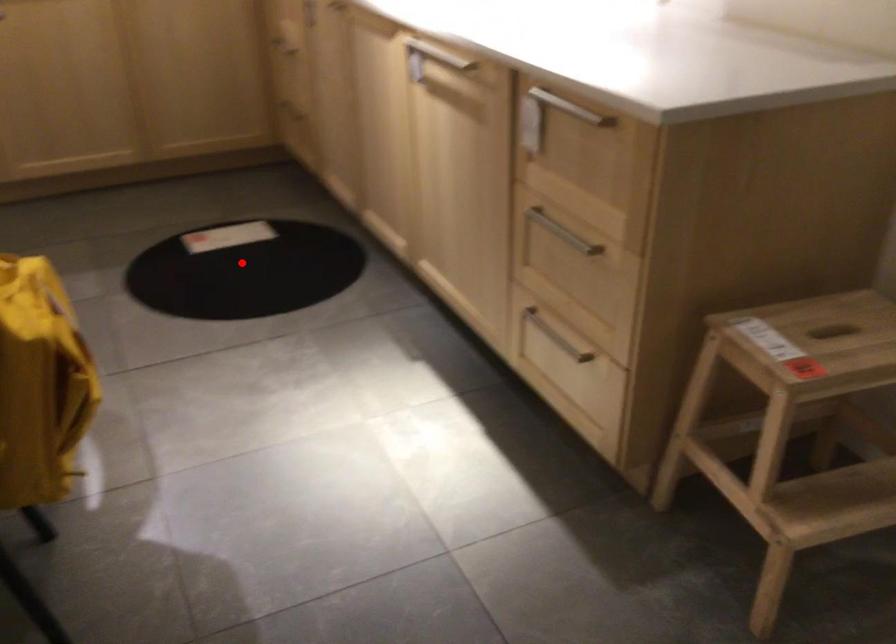
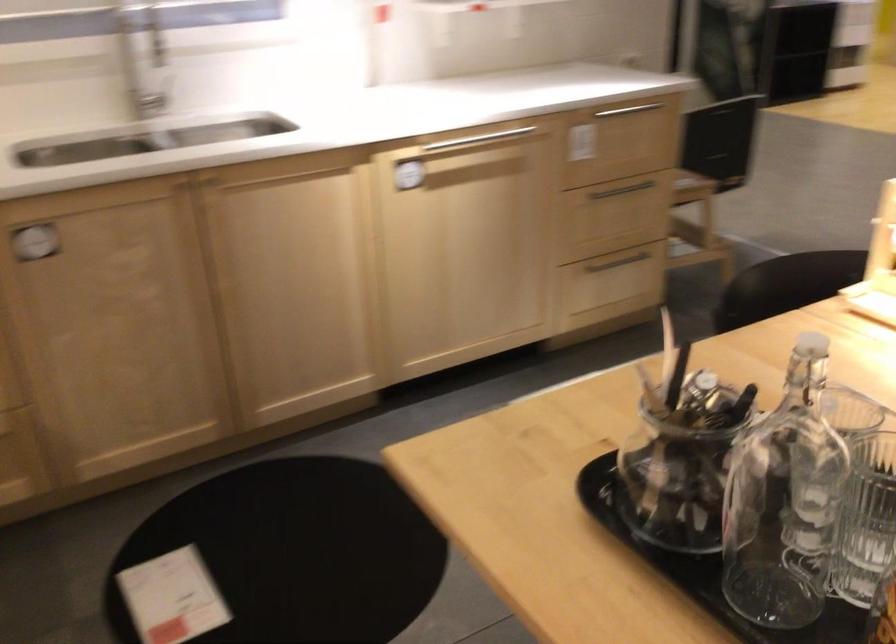
Where in the second image is the point corresponding to the highlighted location from the first image?

(295, 553)